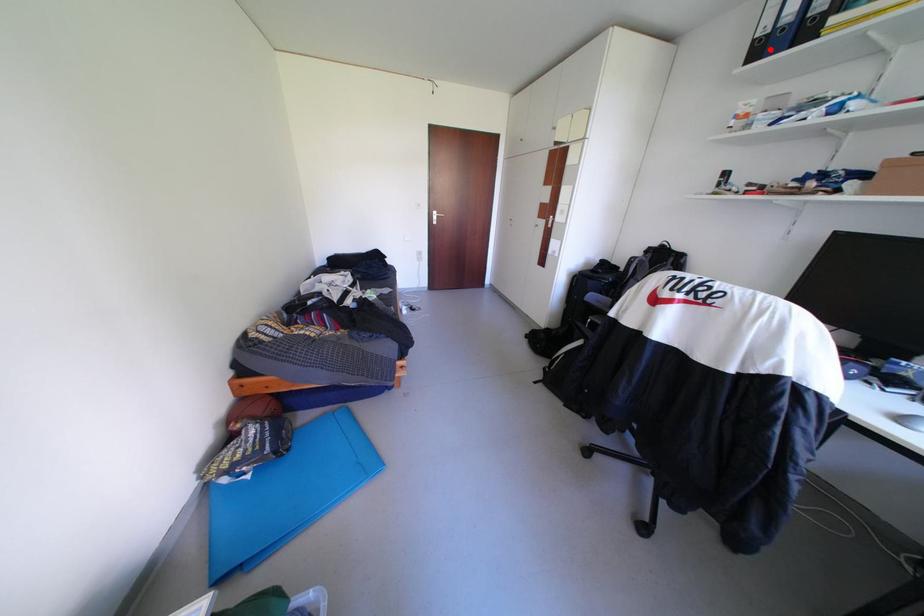
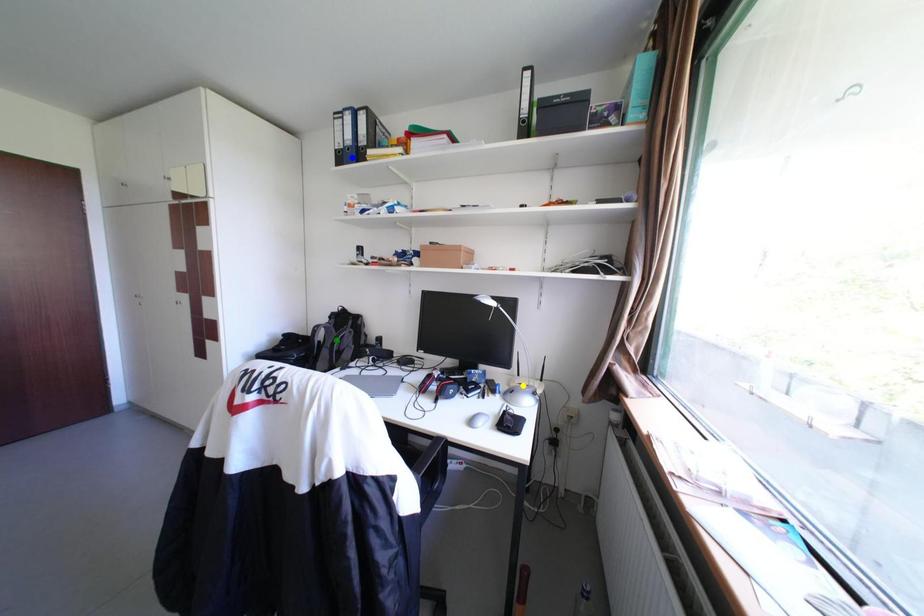
Question: I am providing you with two images of the same scene from different viewpoints. A red point is marked on the first image. You are given multiple points on the second image. Which point in image 2 represents the same 3d spot as the red point in image 1?

Choices:
 (A) green point
 (B) blue point
 (C) yellow point

Answer: (B)